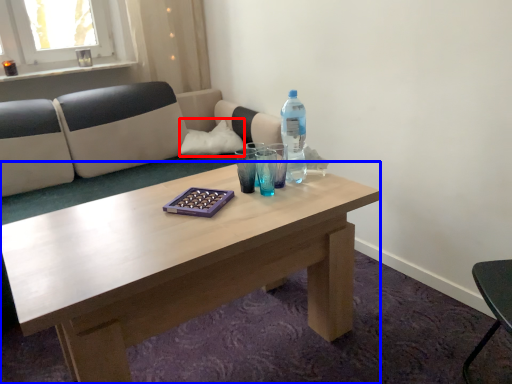
Question: Which object appears farthest to the camera in this image, pillow (highlighted by a red box) or coffee table (highlighted by a blue box)?

Choices:
 (A) pillow
 (B) coffee table

Answer: (A)